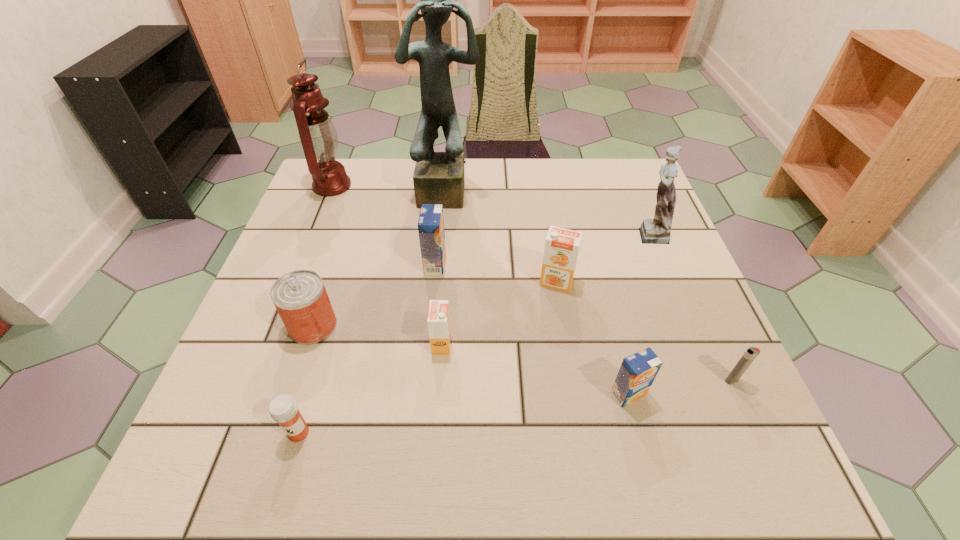
Where is `can`? can is located at coordinates pyautogui.click(x=300, y=297).

Image resolution: width=960 pixels, height=540 pixels. In order to click on the nearer orange orange juice in this screenshot , I will do `click(438, 321)`.

The image size is (960, 540). Identify the location of the left orange orange juice. (438, 321).

Identify the location of the nearest orange_juice. Image resolution: width=960 pixels, height=540 pixels. (637, 372).

Where is `the rightmost orange_juice`? the rightmost orange_juice is located at coordinates (637, 372).

The height and width of the screenshot is (540, 960). Find the location of `igniter`. igniter is located at coordinates (751, 353).

Locate an element on the screen. The height and width of the screenshot is (540, 960). medicine is located at coordinates (283, 408).

The height and width of the screenshot is (540, 960). Find the location of `vacant space located on the face of the gray sculpture`. vacant space located on the face of the gray sculpture is located at coordinates (438, 313).

The width and height of the screenshot is (960, 540). Identify the location of free point located on the right of the oil lamp. (404, 186).

What are the coordinates of `vacant space located 0.210m on the front-facing side of the third farthest object` in the screenshot? It's located at (544, 233).